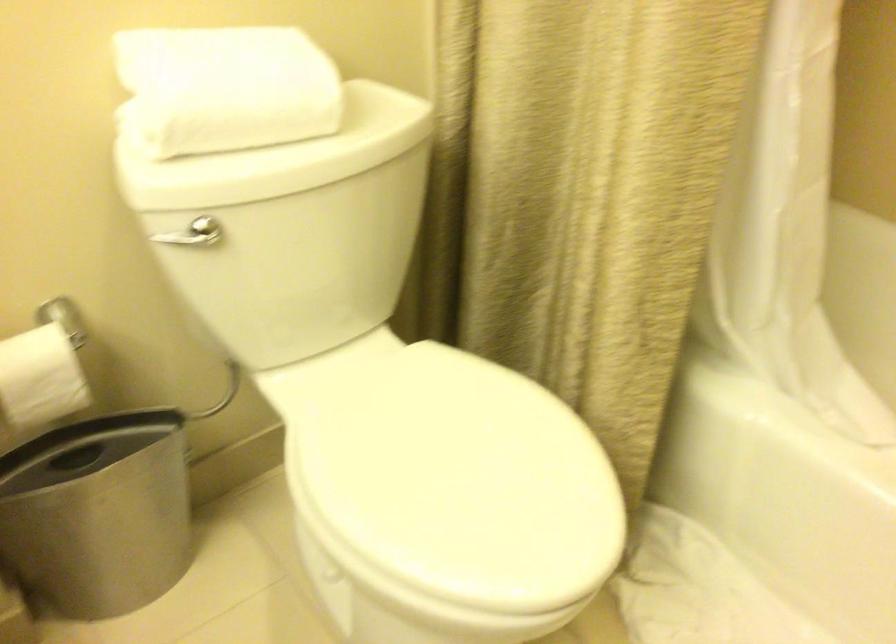
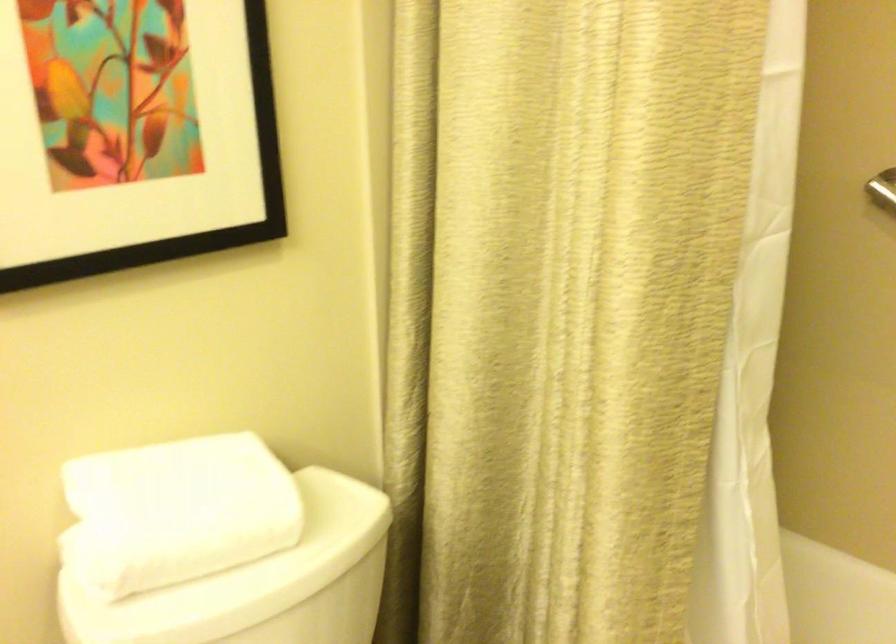
In a continuous first-person perspective shot, in which direction is the camera moving?

The movement direction of the cameraman is left, backward.